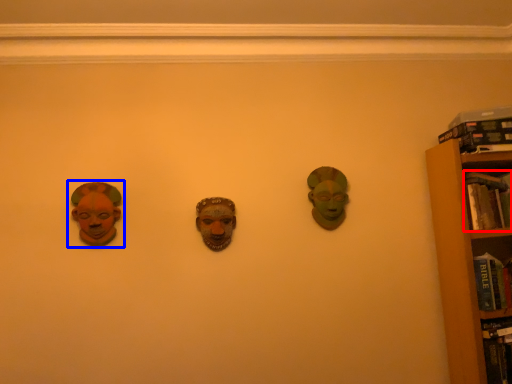
Question: Which object is further to the camera taking this photo, book (highlighted by a red box) or head (highlighted by a blue box)?

Choices:
 (A) book
 (B) head

Answer: (A)